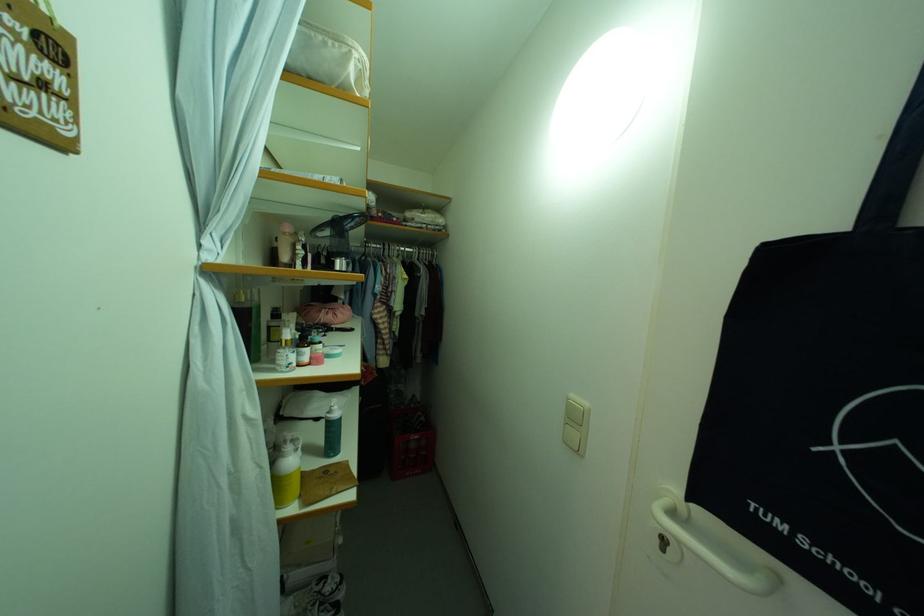
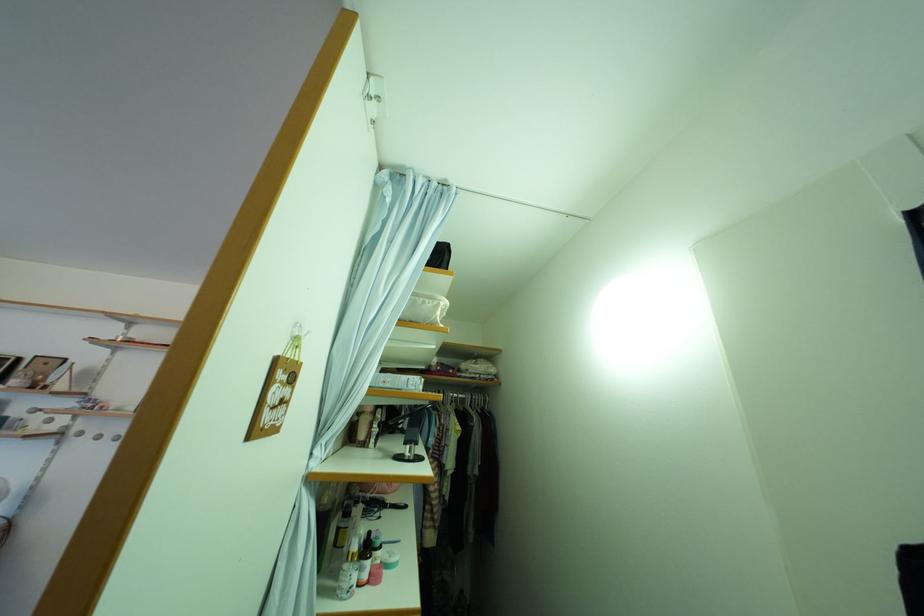
Find the pixel in the second image that matches (x=346, y=268) in the first image.

(417, 454)